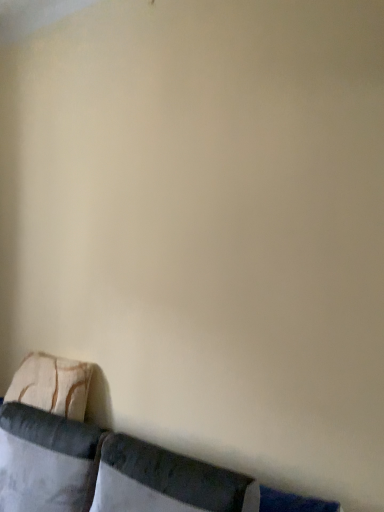
Question: Is white fabric pillow at lower left, the second pillow in the front-to-back sequence, taller than velvet cushion at lower left?

Choices:
 (A) yes
 (B) no

Answer: (B)

Question: From a real-world perspective, is white fabric pillow at lower left, which appears as the 2th pillow when viewed from the back, over velvet cushion at lower left?

Choices:
 (A) yes
 (B) no

Answer: (A)

Question: Does white fabric pillow at lower left, which appears as the 2th pillow when viewed from the back, have a lesser width compared to velvet cushion at lower left?

Choices:
 (A) yes
 (B) no

Answer: (A)

Question: Can you confirm if white fabric pillow at lower left, the second pillow in the front-to-back sequence, is positioned to the left of velvet cushion at lower left?

Choices:
 (A) no
 (B) yes

Answer: (B)

Question: From the image's perspective, is white fabric pillow at lower left, which appears as the 2th pillow when viewed from the back, on top of velvet cushion at lower left?

Choices:
 (A) no
 (B) yes

Answer: (B)

Question: Is textured beige pillow at lower left, marked as the third pillow in a front-to-back arrangement, inside the boundaries of velvet cushion at lower left, or outside?

Choices:
 (A) inside
 (B) outside

Answer: (A)

Question: Considering the positions of point (79, 409) and point (94, 435), is point (79, 409) closer or farther from the camera than point (94, 435)?

Choices:
 (A) closer
 (B) farther

Answer: (B)

Question: Would you say textured beige pillow at lower left, marked as the third pillow in a front-to-back arrangement, is to the left or to the right of velvet cushion at lower left in the picture?

Choices:
 (A) left
 (B) right

Answer: (A)

Question: Looking at the image, does textured beige pillow at lower left, marked as the third pillow in a front-to-back arrangement, seem bigger or smaller compared to velvet cushion at lower left?

Choices:
 (A) big
 (B) small

Answer: (B)

Question: In terms of height, does velvet cushion at lower left look taller or shorter compared to velvet dark gray pillow at lower center, which ranks as the 3th pillow in back-to-front order?

Choices:
 (A) tall
 (B) short

Answer: (A)

Question: Is velvet cushion at lower left situated inside velvet dark gray pillow at lower center, which ranks as the 3th pillow in back-to-front order, or outside?

Choices:
 (A) outside
 (B) inside

Answer: (A)

Question: Based on their sizes in the image, would you say velvet cushion at lower left is bigger or smaller than velvet dark gray pillow at lower center, which ranks as the 3th pillow in back-to-front order?

Choices:
 (A) small
 (B) big

Answer: (B)

Question: In the image, is velvet cushion at lower left positioned in front of or behind velvet dark gray pillow at lower center, arranged as the first pillow when viewed from the front?

Choices:
 (A) front
 (B) behind

Answer: (A)

Question: Would you say velvet cushion at lower left is to the left or to the right of white fabric pillow at lower left, which appears as the 2th pillow when viewed from the back, in the picture?

Choices:
 (A) left
 (B) right

Answer: (B)

Question: From a real-world perspective, relative to white fabric pillow at lower left, which appears as the 2th pillow when viewed from the back, is velvet cushion at lower left vertically above or below?

Choices:
 (A) above
 (B) below

Answer: (B)